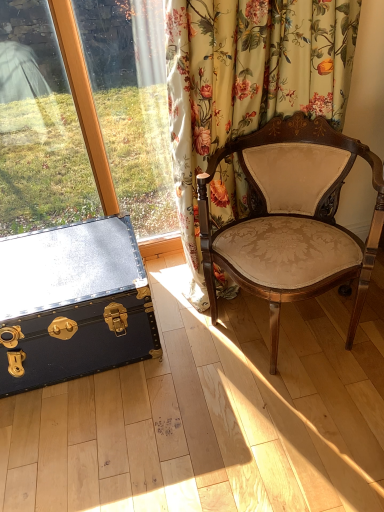
Question: Considering the relative sizes of black leather trunk at lower left and floral fabric curtain at upper right in the image provided, is black leather trunk at lower left wider than floral fabric curtain at upper right?

Choices:
 (A) yes
 (B) no

Answer: (A)

Question: Does black leather trunk at lower left have a lesser width compared to floral fabric curtain at upper right?

Choices:
 (A) no
 (B) yes

Answer: (A)

Question: Is black leather trunk at lower left at the right side of floral fabric curtain at upper right?

Choices:
 (A) no
 (B) yes

Answer: (A)

Question: Does black leather trunk at lower left have a smaller size compared to floral fabric curtain at upper right?

Choices:
 (A) no
 (B) yes

Answer: (B)

Question: Does black leather trunk at lower left come behind floral fabric curtain at upper right?

Choices:
 (A) no
 (B) yes

Answer: (B)

Question: Can you confirm if black leather trunk at lower left is taller than floral fabric curtain at upper right?

Choices:
 (A) yes
 (B) no

Answer: (B)

Question: Does black leather trunk at lower left turn towards velvet beige chair at center?

Choices:
 (A) yes
 (B) no

Answer: (B)

Question: From a real-world perspective, is black leather trunk at lower left located beneath velvet beige chair at center?

Choices:
 (A) no
 (B) yes

Answer: (B)

Question: From a real-world perspective, is black leather trunk at lower left positioned over velvet beige chair at center based on gravity?

Choices:
 (A) no
 (B) yes

Answer: (A)

Question: Is black leather trunk at lower left at the right side of velvet beige chair at center?

Choices:
 (A) no
 (B) yes

Answer: (A)

Question: Does black leather trunk at lower left have a lesser height compared to velvet beige chair at center?

Choices:
 (A) yes
 (B) no

Answer: (A)

Question: Is black leather trunk at lower left positioned behind velvet beige chair at center?

Choices:
 (A) no
 (B) yes

Answer: (B)

Question: Is the depth of floral fabric curtain at upper right greater than that of black leather trunk at lower left?

Choices:
 (A) no
 (B) yes

Answer: (A)